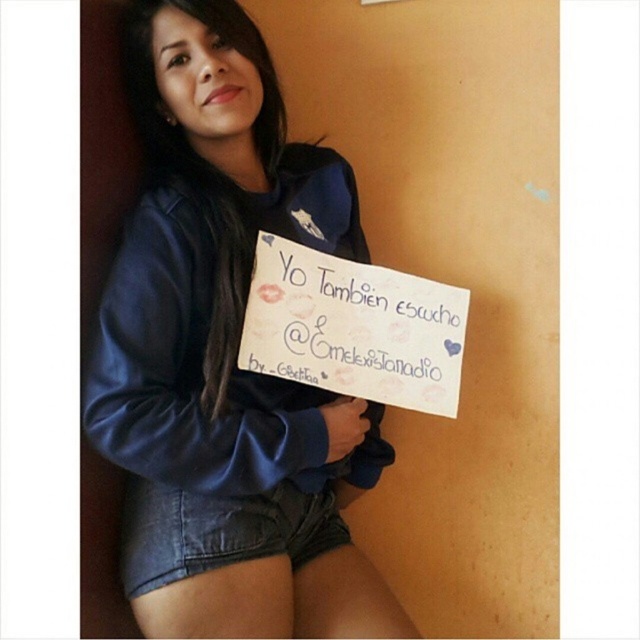
From the picture: You are a photographer trying to capture a candid shot of the woman holding the sign. To ensure both the white paper at center and the denim shorts at lower center are clearly visible in the frame, how far apart are these two items?

The white paper at center and the denim shorts at lower center are 11.37 inches apart from each other.

You are a fashion designer observing the woman in the image. You need to determine the spatial relationship between the blue fleece sweatshirt at upper left and the denim shorts at lower center. Which object is located to the right of the other?

The blue fleece sweatshirt at upper left is positioned on the right side of denim shorts at lower center.